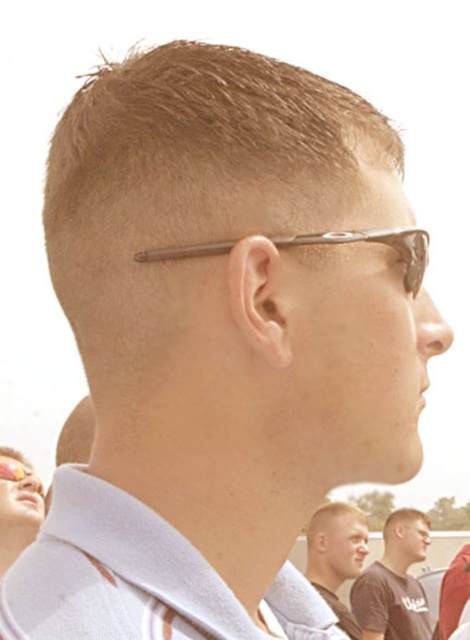
You are a photographer adjusting the lighting for a portrait. You notice the brown matte hair at center and the matte brown sunglasses at upper center. Which object is positioned more to the right in the frame?

The matte brown sunglasses at upper center are positioned more to the right in the frame compared to the brown matte hair at center, as the hair is to the left of the sunglasses.

Consider the image. You are a photographer adjusting your camera settings to capture the main subject. Based on the scene, where is the brown matte hair at center in relation to the matte brown sunglasses at upper center?

The brown matte hair at center is above the matte brown sunglasses at upper center.

You are a photographer adjusting the focus on your camera. You want to capture a clear image of both the matte yellow sunglasses at upper left and the sunglasses at upper center. Given the current focus settings, which object is closer to the camera lens?

The matte yellow sunglasses at upper left is closer to the camera lens because it is only 3.57 inches away from the sunglasses at upper center.